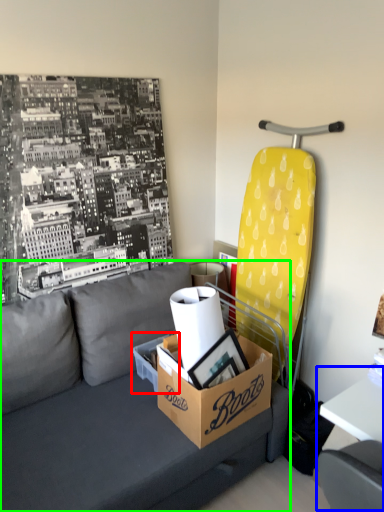
Question: Which object is the farthest from cardboard box (highlighted by a red box)? Choose among these: table (highlighted by a blue box) or studio couch (highlighted by a green box).

Choices:
 (A) table
 (B) studio couch

Answer: (A)